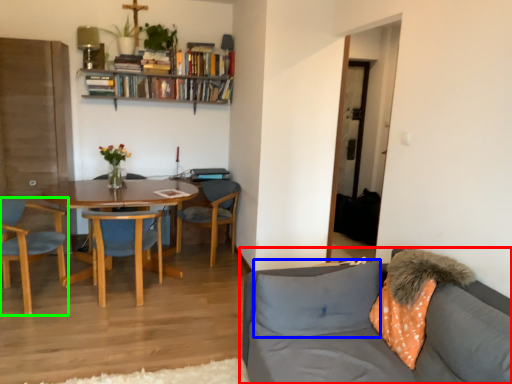
Question: Based on their relative distances, which object is farther from studio couch (highlighted by a red box)? Choose from pillow (highlighted by a blue box) and chair (highlighted by a green box).

Choices:
 (A) pillow
 (B) chair

Answer: (B)